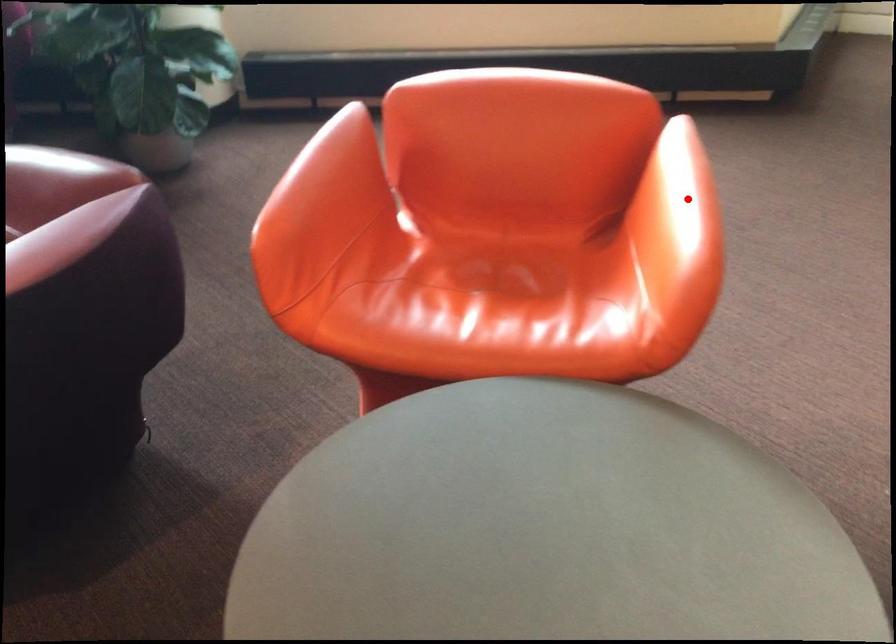
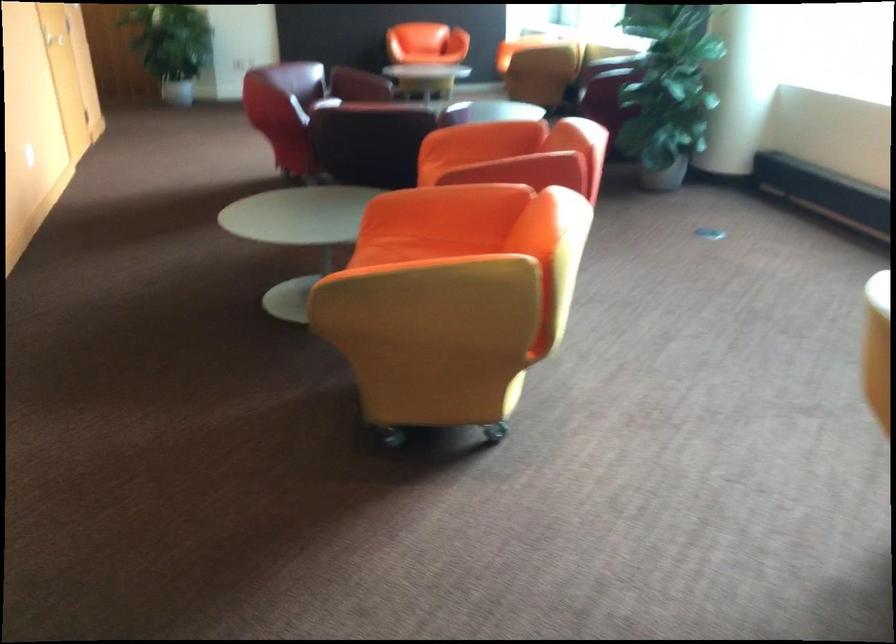
The point at the highlighted location is marked in the first image. Where is the corresponding point in the second image?

(492, 151)